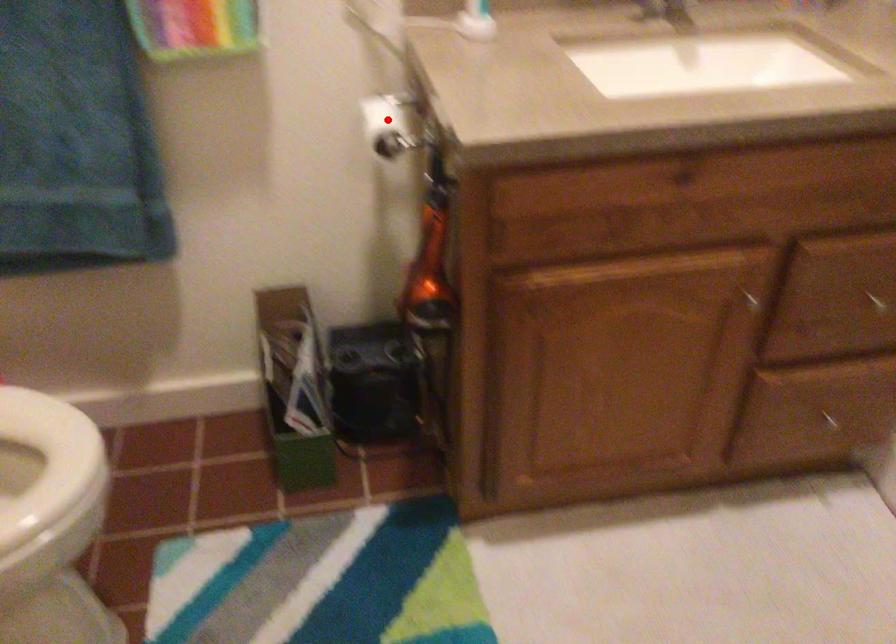
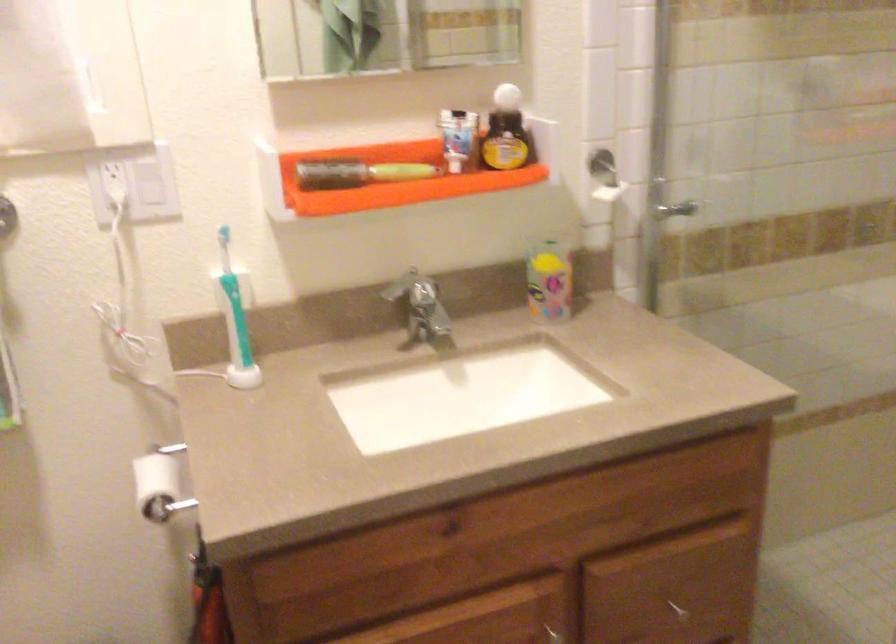
In the second image, find the point that corresponds to the highlighted location in the first image.

(159, 484)